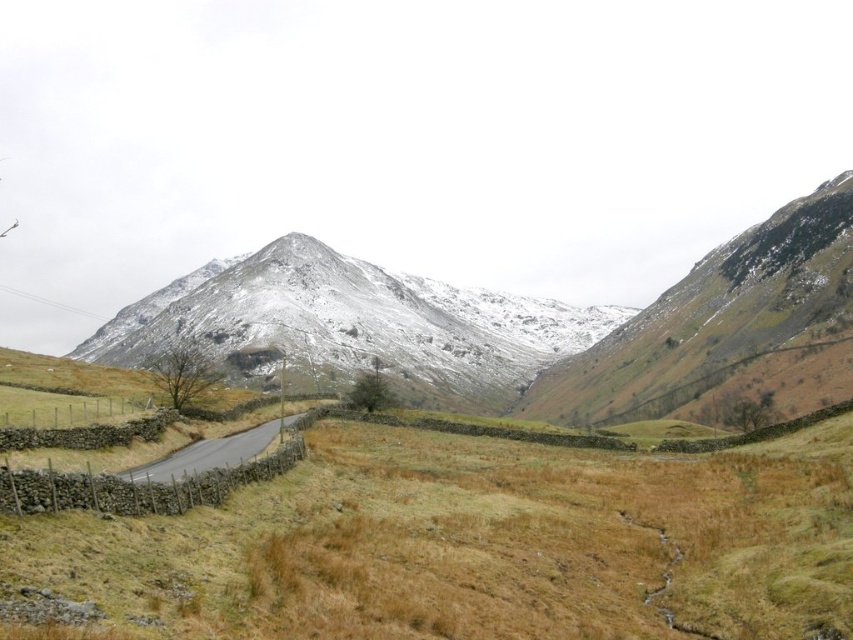
Between snowy rock mountain at center and black asphalt road at center, which one appears on the left side from the viewer's perspective?

black asphalt road at center

Is snowy rock mountain at center positioned at the back of black asphalt road at center?

Yes, snowy rock mountain at center is further from the viewer.

Is point (474, 404) positioned after point (222, 456)?

Yes.

This screenshot has height=640, width=853. In order to click on snowy rock mountain at center in this screenshot , I will do `click(352, 324)`.